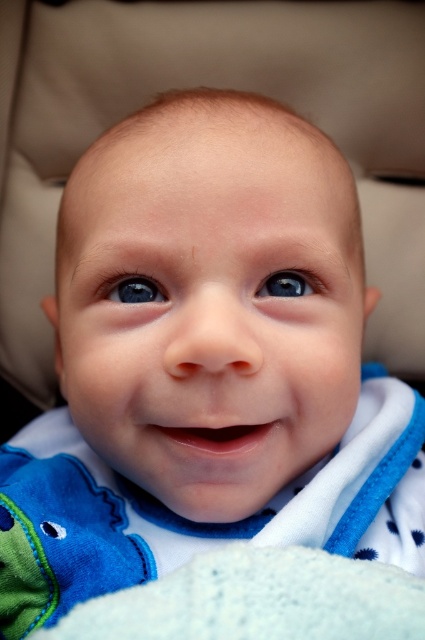
Describe the element at coordinates (192, 522) in the screenshot. This screenshot has height=640, width=425. I see `blue fleece bib at center` at that location.

Which is above, blue fleece bib at center or blue glossy eye at upper center?

blue glossy eye at upper center

Which is in front, point (136, 536) or point (152, 292)?

Point (152, 292) is in front.

What are the coordinates of `blue fleece bib at center` in the screenshot? It's located at (192, 522).

Which is in front, point (342, 465) or point (289, 636)?

Point (289, 636) is more forward.

Is blue fleece bib at center bigger than white soft blanket at lower center?

Correct, blue fleece bib at center is larger in size than white soft blanket at lower center.

Between point (404, 528) and point (169, 604), which one is positioned behind?

The point (404, 528) is behind.

The image size is (425, 640). Identify the location of blue fleece bib at center. (192, 522).

Does blue glossy eye at upper center have a greater width compared to blue glossy eye at center?

In fact, blue glossy eye at upper center might be narrower than blue glossy eye at center.

Based on the photo, is blue glossy eye at upper center closer to the viewer compared to blue glossy eye at center?

No, it is behind blue glossy eye at center.

Is point (119, 300) less distant than point (280, 278)?

No, (119, 300) is behind (280, 278).

I want to click on blue glossy eye at upper center, so click(133, 291).